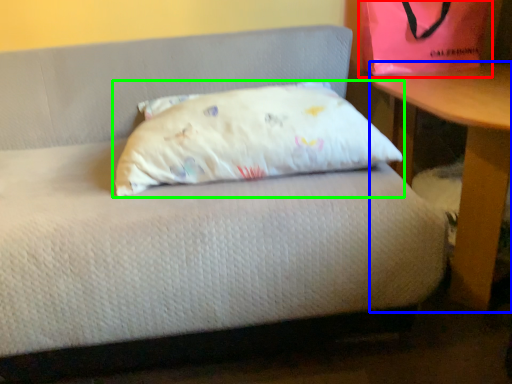
Question: Based on their relative distances, which object is farther from bean bag chair (highlighted by a red box)? Choose from table (highlighted by a blue box) and pillow (highlighted by a green box).

Choices:
 (A) table
 (B) pillow

Answer: (B)